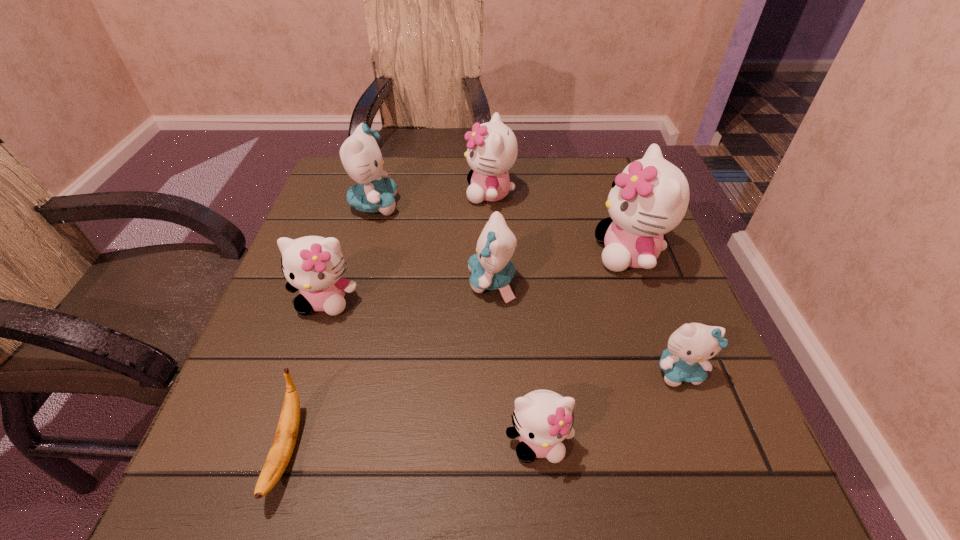
At what (x,y) coordinates should I click in order to perform the action: click on the smallest blue kitten. Please return your answer as a coordinate pair (x, y). This screenshot has height=540, width=960. Looking at the image, I should click on (690, 346).

Image resolution: width=960 pixels, height=540 pixels. Find the location of `the nearest blue kitten`. the nearest blue kitten is located at coordinates (690, 346).

The width and height of the screenshot is (960, 540). I want to click on yellow banana, so click(284, 441).

Locate an element on the screen. This screenshot has width=960, height=540. banana is located at coordinates (284, 441).

The height and width of the screenshot is (540, 960). What are the coordinates of `free space located 0.130m on the front-facing side of the biggest white kitten` in the screenshot? It's located at (535, 254).

This screenshot has height=540, width=960. I want to click on free location located 0.150m on the front-facing side of the biggest white kitten, so click(525, 254).

Image resolution: width=960 pixels, height=540 pixels. Find the location of `vacant space located on the front-facing side of the biggest white kitten`. vacant space located on the front-facing side of the biggest white kitten is located at coordinates (497, 254).

The image size is (960, 540). I want to click on free space located on the face of the farthest blue kitten, so click(x=541, y=205).

Where is `vacant space located on the front-facing side of the farthest white kitten`? vacant space located on the front-facing side of the farthest white kitten is located at coordinates (335, 193).

I want to click on free point located 0.060m on the front-facing side of the farthest white kitten, so click(x=442, y=193).